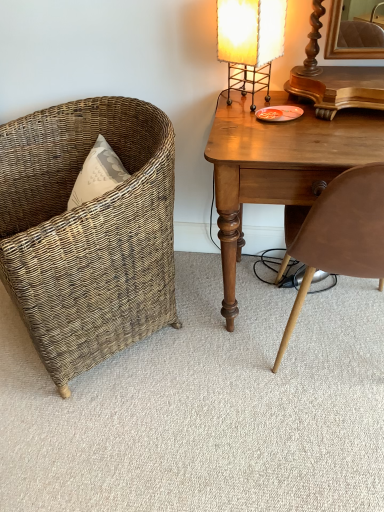
Find the location of `free space above woven wicker chair at left (from a real-world perspective)`. free space above woven wicker chair at left (from a real-world perspective) is located at coordinates (204, 382).